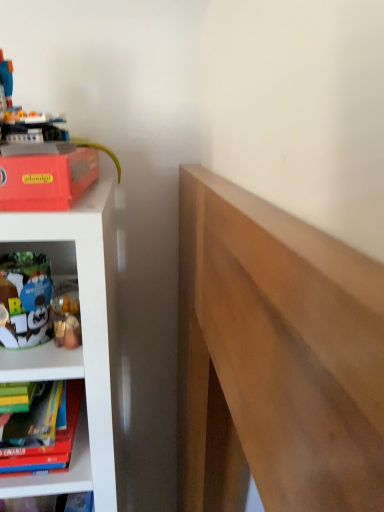
Question: In the image, is plastic toy robot at upper left, the 2th toy in the bottom-to-top sequence, positioned in front of or behind white plush toy at lower left, the 2th toy from the top?

Choices:
 (A) behind
 (B) front

Answer: (B)

Question: Is plastic toy robot at upper left, arranged as the first toy when viewed from the top, taller or shorter than white plush toy at lower left, which is counted as the 1th toy, starting from the bottom?

Choices:
 (A) short
 (B) tall

Answer: (B)

Question: Estimate the real-world distances between objects in this image. Which object is farther from the matte red paperback book at upper left?

Choices:
 (A) plastic toy robot at upper left, the 2th toy in the bottom-to-top sequence
 (B) white plush toy at lower left, the 2th toy from the top

Answer: (B)

Question: Which is farther from the white plush toy at lower left, which is counted as the 1th toy, starting from the bottom?

Choices:
 (A) matte red paperback book at upper left
 (B) plastic toy robot at upper left, the 2th toy in the bottom-to-top sequence

Answer: (B)